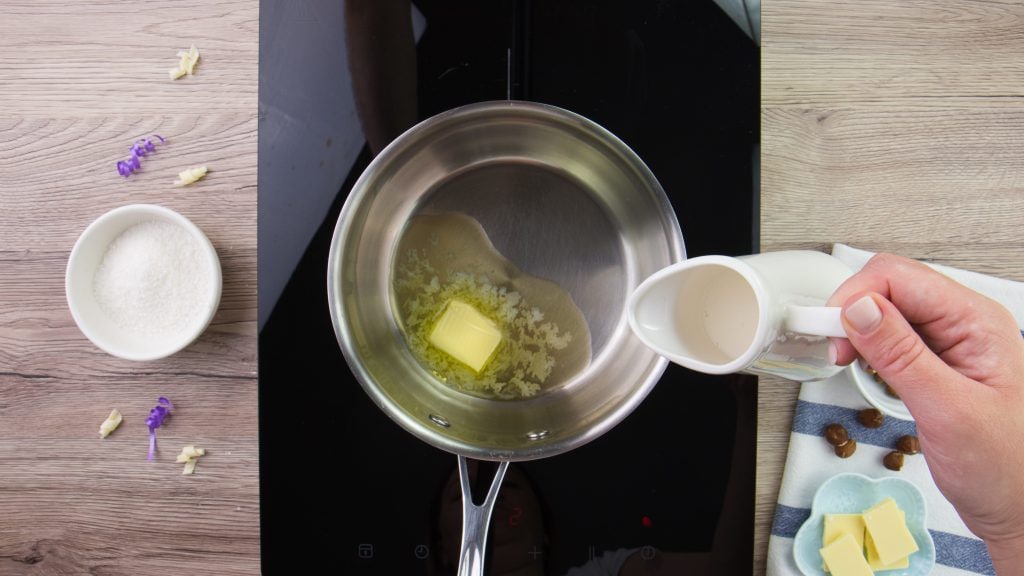
In order to click on blue and white towel in this screenshot , I will do coord(800,458).